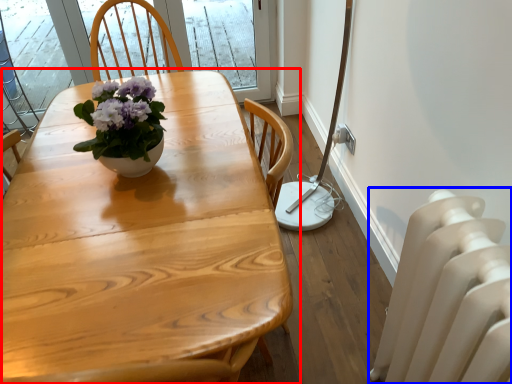
Question: Among these objects, which one is farthest to the camera, table (highlighted by a red box) or radiator (highlighted by a blue box)?

Choices:
 (A) table
 (B) radiator

Answer: (B)